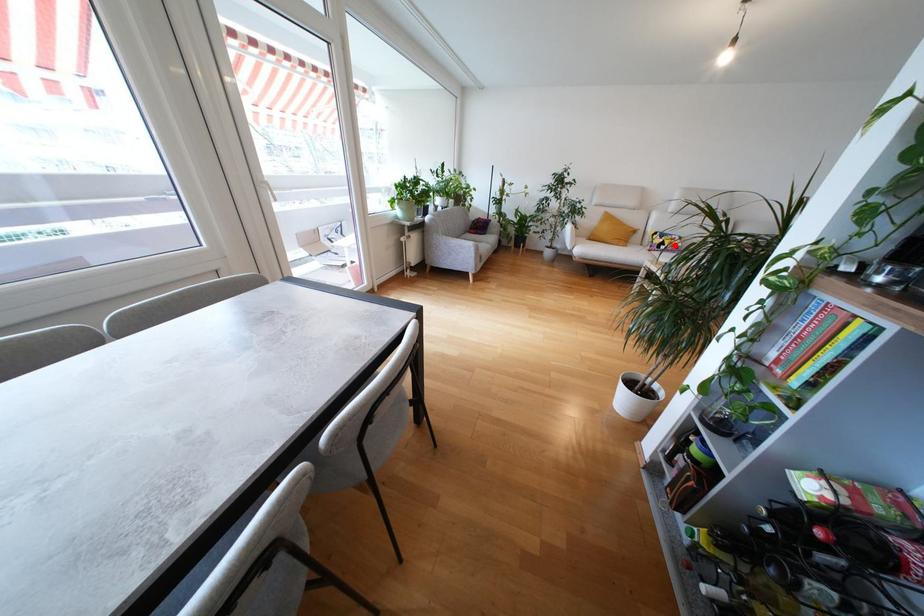
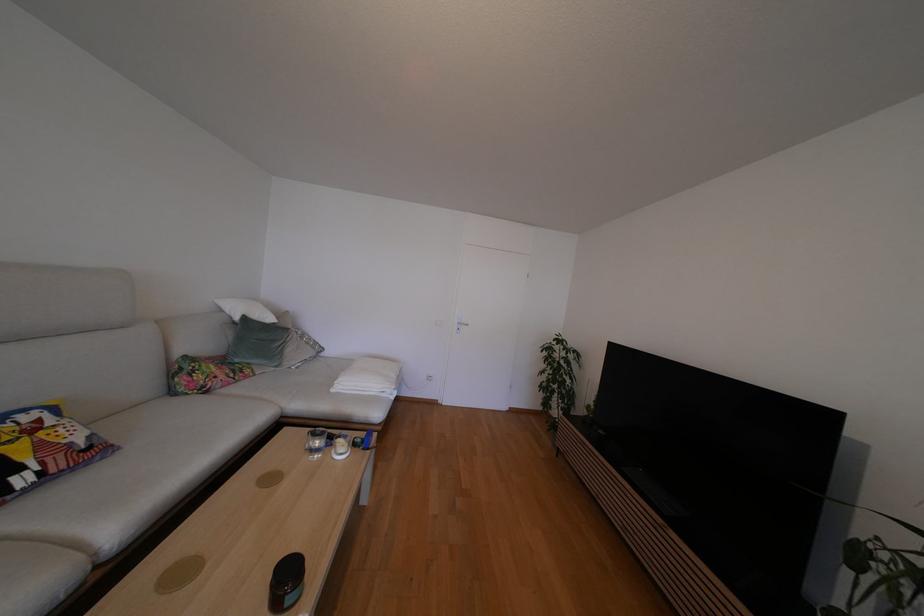
Find the pixel in the second image that matches the highlighted location in the first image.

(44, 448)